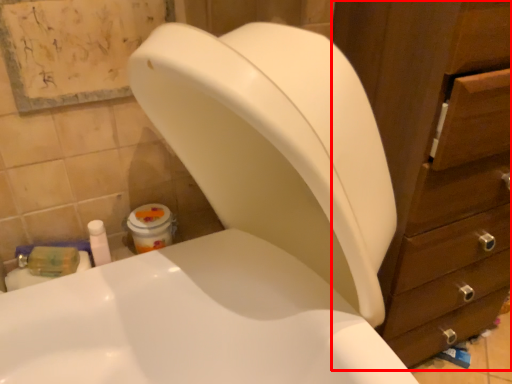
Question: From the image's perspective, where is cabinet (annotated by the red box) located relative to toiletry?

Choices:
 (A) above
 (B) below

Answer: (A)